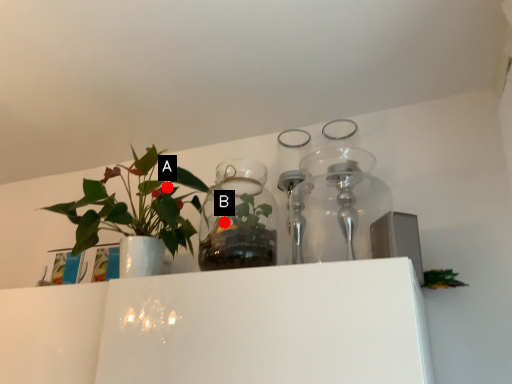
Question: Two points are circled on the image, labeled by A and B beside each circle. Which of the following is the closest to the observer?

Choices:
 (A) A is closer
 (B) B is closer

Answer: (A)